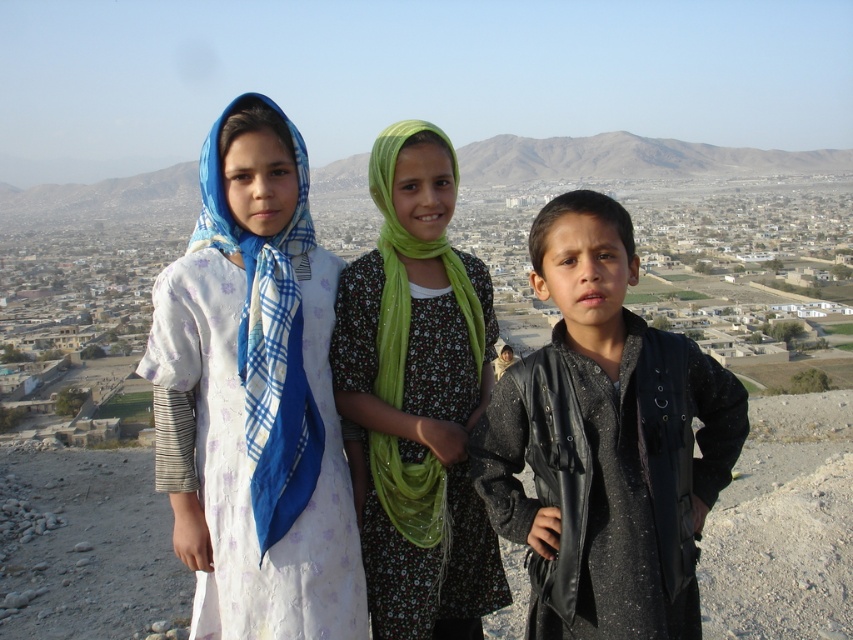
Question: Where is white floral dress at center located in relation to green fabric scarf at center in the image?

Choices:
 (A) above
 (B) below

Answer: (A)

Question: Does white floral dress at center appear over black leather jacket at center?

Choices:
 (A) yes
 (B) no

Answer: (A)

Question: Which of the following is the farthest from the observer?

Choices:
 (A) green fabric scarf at center
 (B) rugged brown hill at upper center
 (C) white floral dress at center

Answer: (B)

Question: Is green fabric scarf at center to the left of rugged brown hill at upper center from the viewer's perspective?

Choices:
 (A) yes
 (B) no

Answer: (B)

Question: Which is nearer to the green fabric scarf at center?

Choices:
 (A) black leather jacket at center
 (B) rugged brown hill at upper center
 (C) white floral dress at center

Answer: (C)

Question: Among these points, which one is farthest from the camera?

Choices:
 (A) tap(498, 141)
 (B) tap(399, 195)
 (C) tap(285, 518)

Answer: (A)